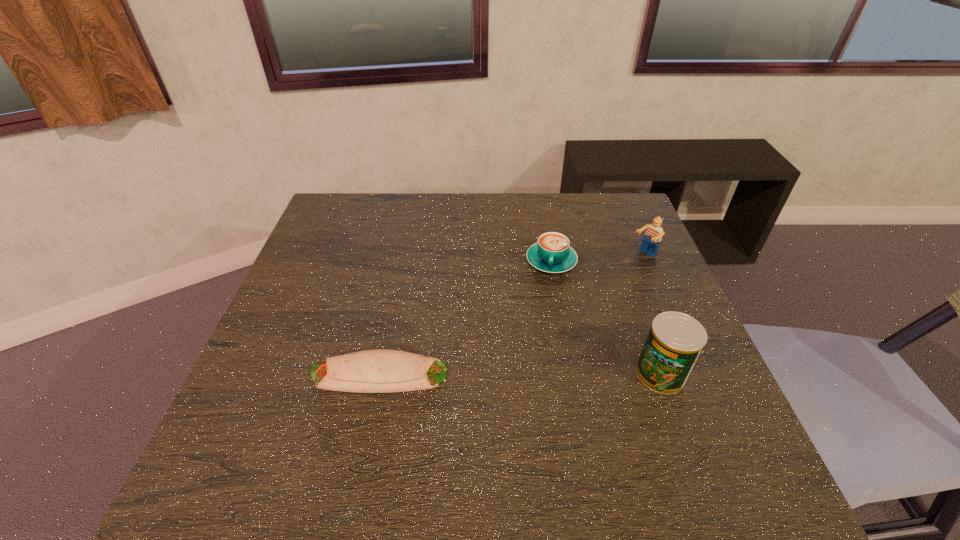
Identify the location of the shortest object. pos(380,370).

Where is `burrito`? This screenshot has width=960, height=540. burrito is located at coordinates (380, 370).

Find the location of a particular element. Image resolution: width=960 pixels, height=540 pixels. can is located at coordinates (675, 341).

This screenshot has height=540, width=960. I want to click on the third tallest object, so click(552, 253).

This screenshot has height=540, width=960. In order to click on the third object from right to left in this screenshot , I will do `click(552, 253)`.

Find the location of `Lego`. Lego is located at coordinates (652, 238).

Find the location of `vacant space situated at the bitten end of the shortest object`. vacant space situated at the bitten end of the shortest object is located at coordinates (264, 375).

Locate an element on the screen. The height and width of the screenshot is (540, 960). vacant space located on the back of the tallest object is located at coordinates (647, 338).

Locate an element on the screen. free spot located with the handle on the right side of the second object from left to right is located at coordinates (532, 386).

Locate an element on the screen. Image resolution: width=960 pixels, height=540 pixels. free space located with the handle on the right side of the second object from left to right is located at coordinates (537, 353).